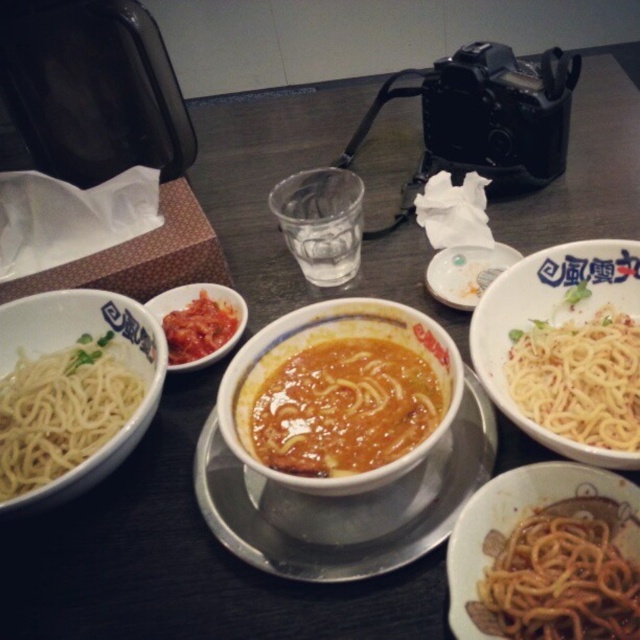
Question: Among these points, which one is nearest to the camera?

Choices:
 (A) (168, 292)
 (B) (125, 326)
 (C) (564, 620)

Answer: (C)

Question: Considering the relative positions of matte ceramic bowl at center and white glossy bowl at right in the image provided, where is matte ceramic bowl at center located with respect to white glossy bowl at right?

Choices:
 (A) right
 (B) left

Answer: (B)

Question: Which point appears closest to the camera in this image?

Choices:
 (A) (394, 480)
 (B) (508, 256)

Answer: (A)

Question: Which of the following is the farthest from the observer?

Choices:
 (A) white matte spaghetti at right
 (B) brown matte noodles at lower right
 (C) tomato paste at center
 (D) white matte noodles at left

Answer: (C)

Question: Can you confirm if matte ceramic bowl at center is bigger than white matte spaghetti at right?

Choices:
 (A) yes
 (B) no

Answer: (A)

Question: Is white glossy bowl at center closer to camera compared to white glossy bowl at right?

Choices:
 (A) yes
 (B) no

Answer: (B)